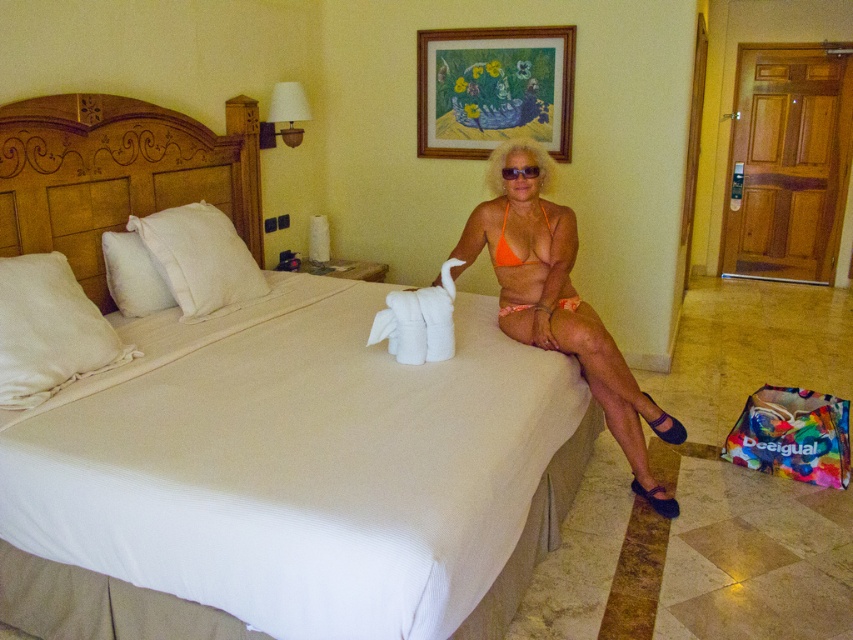
Question: Can you confirm if white textured bed at center is thinner than orange bikini at center?

Choices:
 (A) no
 (B) yes

Answer: (B)

Question: Can you confirm if orange bikini at center is bigger than white fluffy pillow at left?

Choices:
 (A) yes
 (B) no

Answer: (A)

Question: Among these objects, which one is nearest to the camera?

Choices:
 (A) white textured bed at center
 (B) white soft pillow at left

Answer: (B)

Question: Is white soft pillow at left bigger than orange matte bikini at center?

Choices:
 (A) yes
 (B) no

Answer: (A)

Question: Which of the following is the farthest from the observer?

Choices:
 (A) white textured bed at center
 (B) white fluffy pillow at left
 (C) orange matte bikini top at center

Answer: (B)

Question: Which point is farther to the camera?

Choices:
 (A) (527, 305)
 (B) (151, 234)
 (C) (30, 202)
 (D) (630, 397)

Answer: (B)